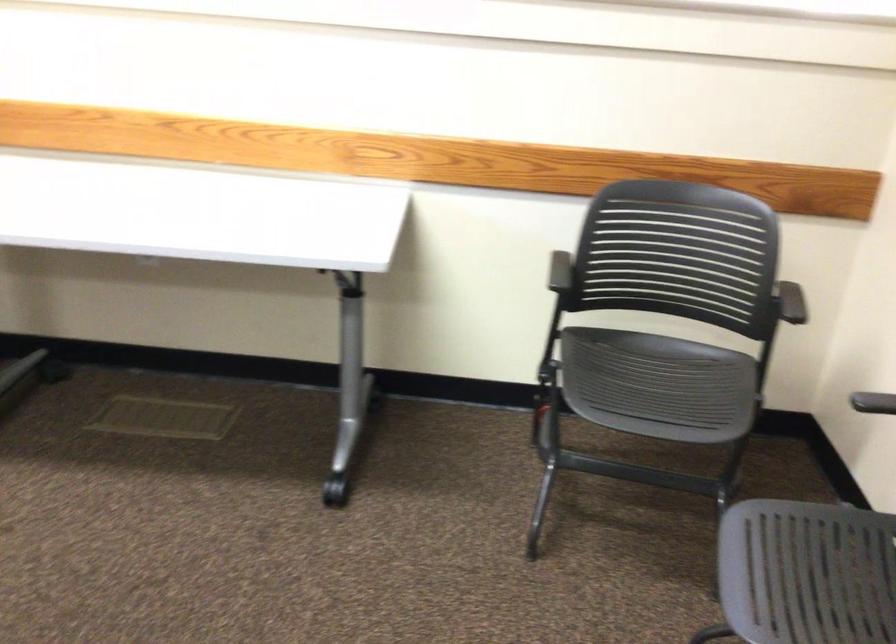
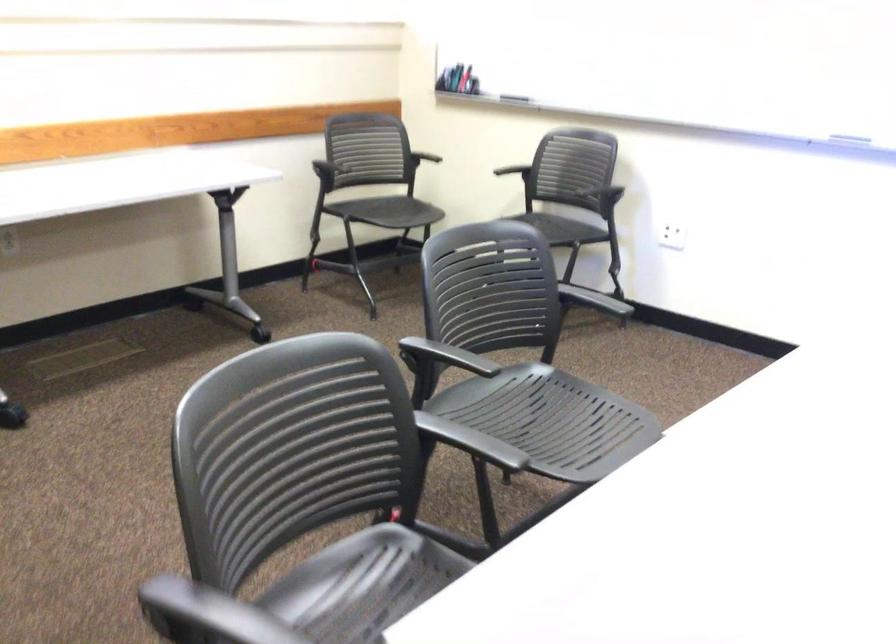
The point at (873, 402) is marked in the first image. Where is the corresponding point in the second image?

(506, 164)